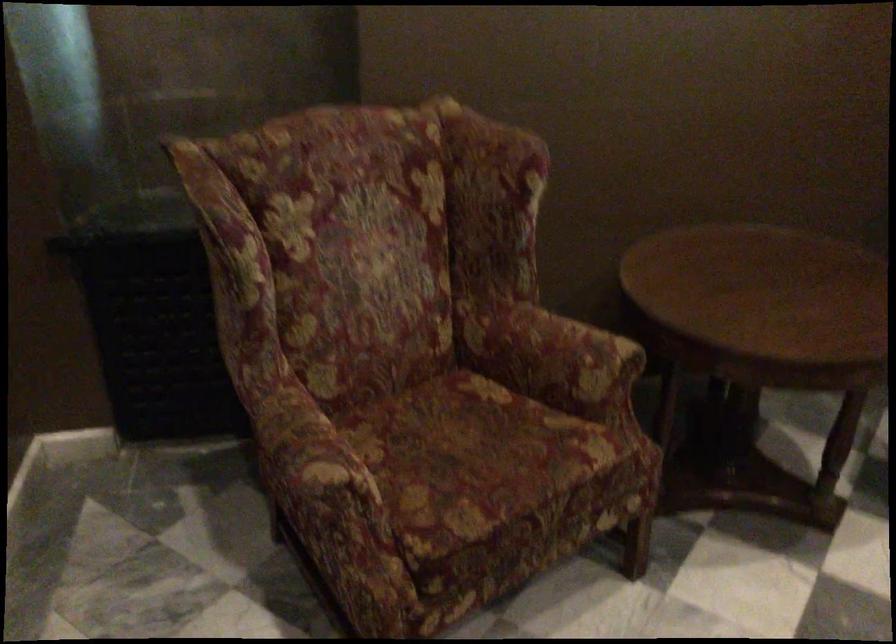
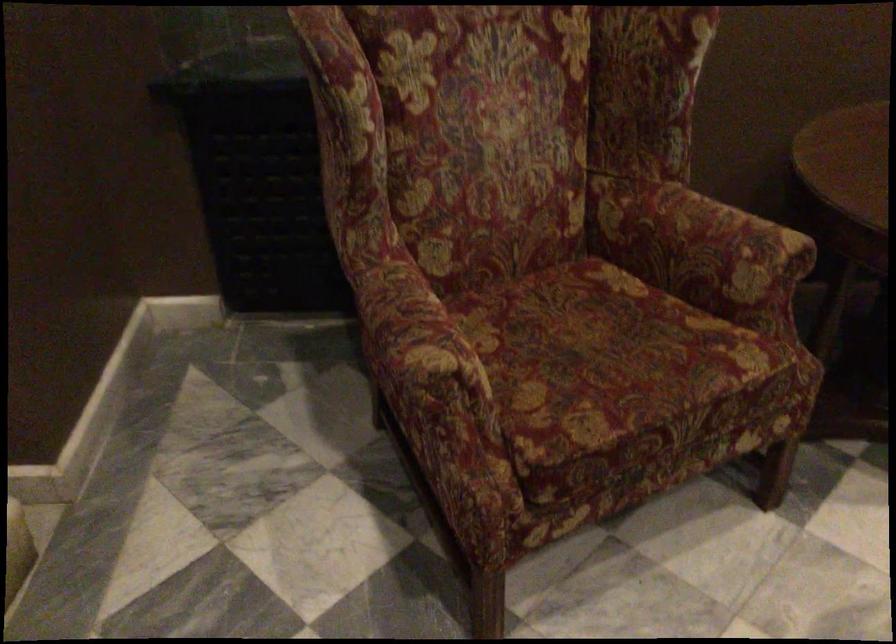
Question: What movement of the cameraman would produce the second image?

Choices:
 (A) Left
 (B) Right
 (C) Forward
 (D) Backward

Answer: (C)